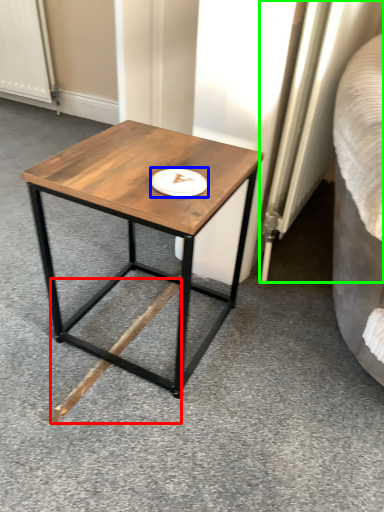
Question: Based on their relative distances, which object is nearer to wood (highlighted by a red box)? Choose from platter (highlighted by a blue box) and radiator (highlighted by a green box).

Choices:
 (A) platter
 (B) radiator

Answer: (A)